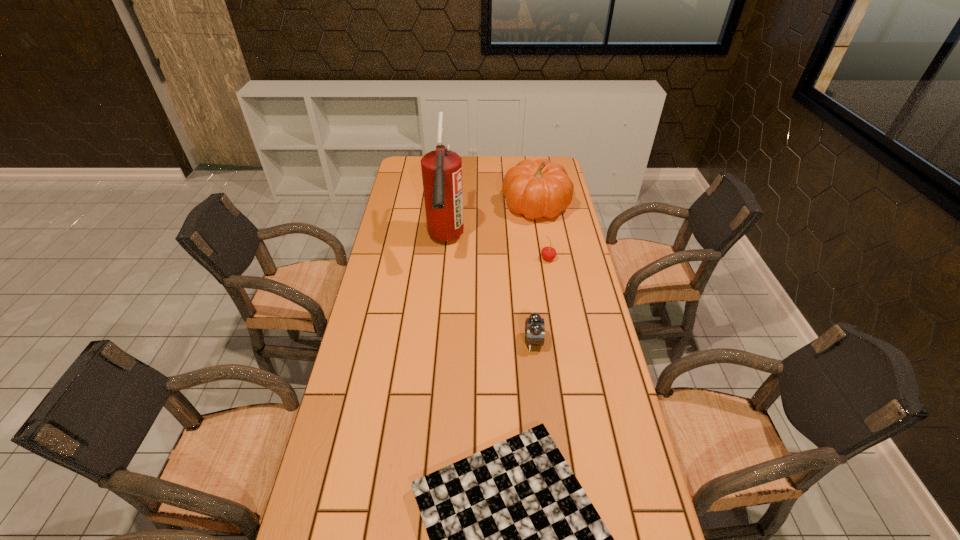
The width and height of the screenshot is (960, 540). I want to click on the tallest object, so click(441, 169).

Find the location of `pumpkin`. pumpkin is located at coordinates (536, 189).

What are the coordinates of `cherry` in the screenshot? It's located at (548, 253).

The width and height of the screenshot is (960, 540). What are the coordinates of `the fourth farthest object` in the screenshot? It's located at (534, 325).

Find the location of a particular element. Image resolution: width=960 pixels, height=540 pixels. vacant area located 0.090m at the nozzle of the tallest object is located at coordinates (441, 289).

I want to click on free space located 0.220m on the front of the pumpkin, so click(x=545, y=261).

At what (x,y) coordinates should I click in order to perform the action: click on blank area located 0.320m on the back of the cherry. Please return your answer as a coordinate pair (x, y). Looking at the image, I should click on click(x=540, y=207).

Where is `free spot located 0.300m on the front side of the fourth farthest object`? This screenshot has width=960, height=540. free spot located 0.300m on the front side of the fourth farthest object is located at coordinates (429, 341).

Where is `free location located 0.170m on the front side of the fourth farthest object`? Image resolution: width=960 pixels, height=540 pixels. free location located 0.170m on the front side of the fourth farthest object is located at coordinates (470, 341).

Locate an element on the screen. This screenshot has height=540, width=960. free point located 0.260m on the front side of the fourth farthest object is located at coordinates (442, 341).